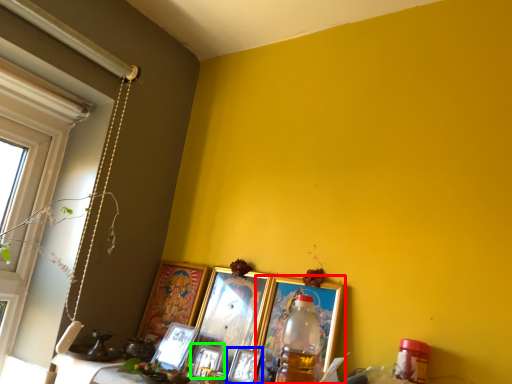
Question: Which is nearer to the picture frame (highlighted by a red box)? picture frame (highlighted by a blue box) or picture frame (highlighted by a green box).

Choices:
 (A) picture frame
 (B) picture frame

Answer: (A)